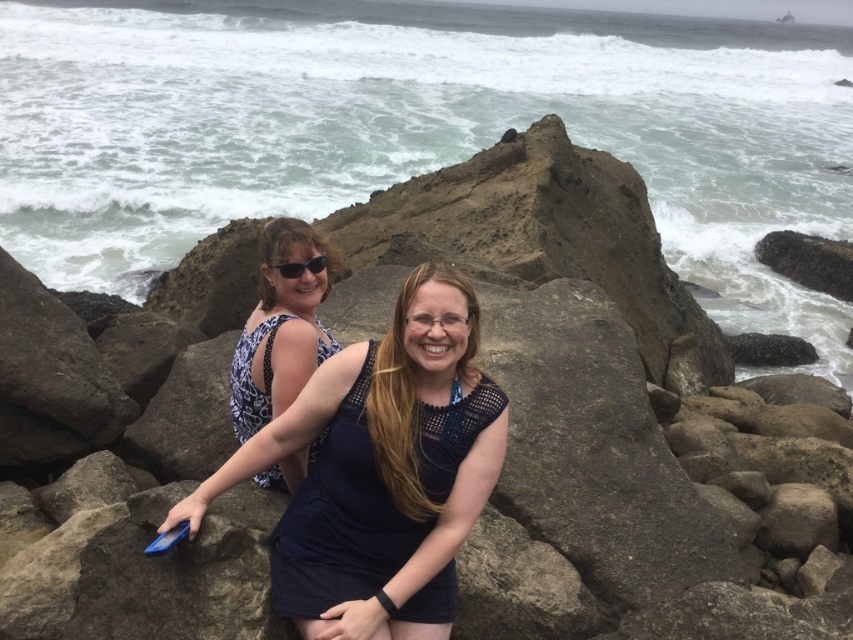
You are a photographer trying to capture a clear shot of both the blue dotted dress at center and the black plastic sunglasses at upper center. Which object should you focus on first if you want to ensure both are in focus?

The blue dotted dress at center is wider than the black plastic sunglasses at upper center, so focusing on the wider object first would help ensure both are in focus.

You are a fashion designer analyzing the image. There is a point at coordinates point at (x=381, y=472). Which object in the scene does this point belong to?

The point at (x=381, y=472) is on the dark blue fabric dress at center.

You are a fashion designer analyzing the image. You need to determine which item is higher in the photo between the dark blue fabric dress at center and the black plastic sunglasses at upper center. Which one is taller?

The dark blue fabric dress at center is taller than the black plastic sunglasses at upper center according to the description.